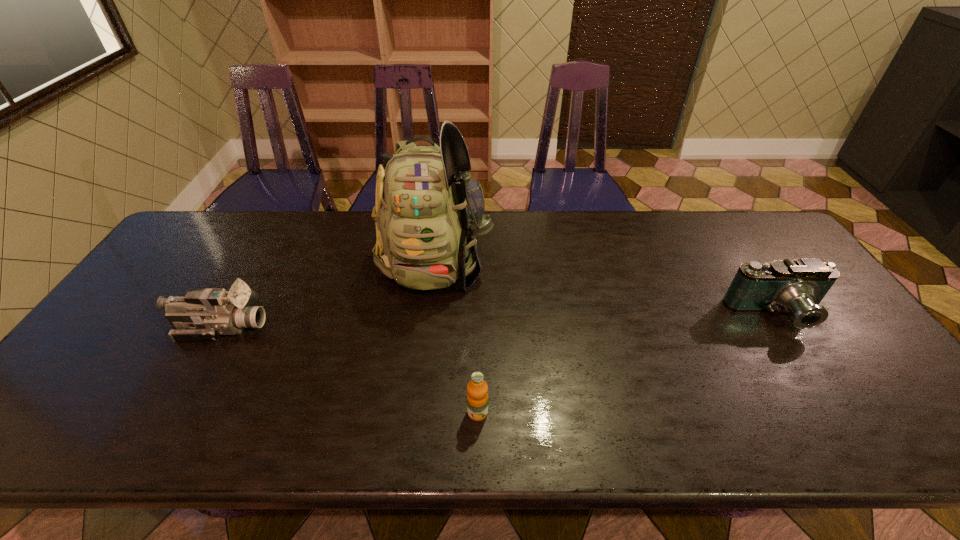
Image resolution: width=960 pixels, height=540 pixels. I want to click on vacant area that lies between the right camcorder and the orange juice, so click(627, 364).

The image size is (960, 540). In order to click on empty space that is in between the backpack and the nearest object in this screenshot , I will do `click(457, 335)`.

At what (x,y) coordinates should I click in order to perform the action: click on free spot between the tallest object and the left camcorder. Please return your answer as a coordinate pair (x, y). The height and width of the screenshot is (540, 960). Looking at the image, I should click on (329, 293).

I want to click on vacant area that lies between the rightmost object and the leftmost object, so click(x=499, y=322).

Locate which object is the second closest to the left camcorder. Please provide its 2D coordinates. Your answer should be formatted as a tuple, i.e. [(x, y)], where the tuple contains the x and y coordinates of a point satisfying the conditions above.

[(477, 389)]

This screenshot has height=540, width=960. Identify the location of the third closest object to the leftmost object. (797, 286).

Locate an element on the screen. blank space that satisfies the following two spatial constraints: 1. on the front-facing side of the backpack; 2. on the front-facing side of the leftmost object is located at coordinates (428, 327).

Where is `vacant space that satisfies the following two spatial constraints: 1. on the front-facing side of the tallest object; 2. on the front-facing side of the left camcorder`? The height and width of the screenshot is (540, 960). vacant space that satisfies the following two spatial constraints: 1. on the front-facing side of the tallest object; 2. on the front-facing side of the left camcorder is located at coordinates (428, 327).